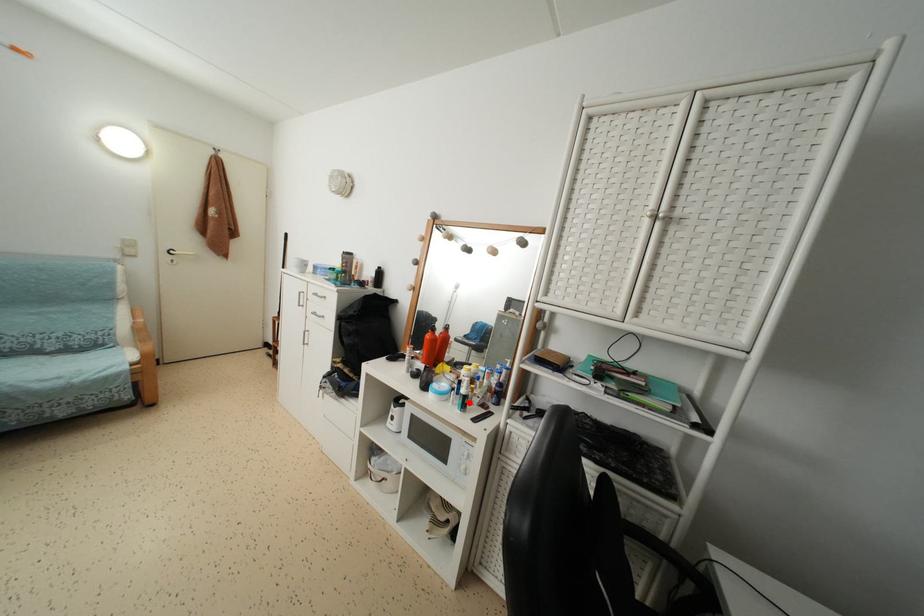
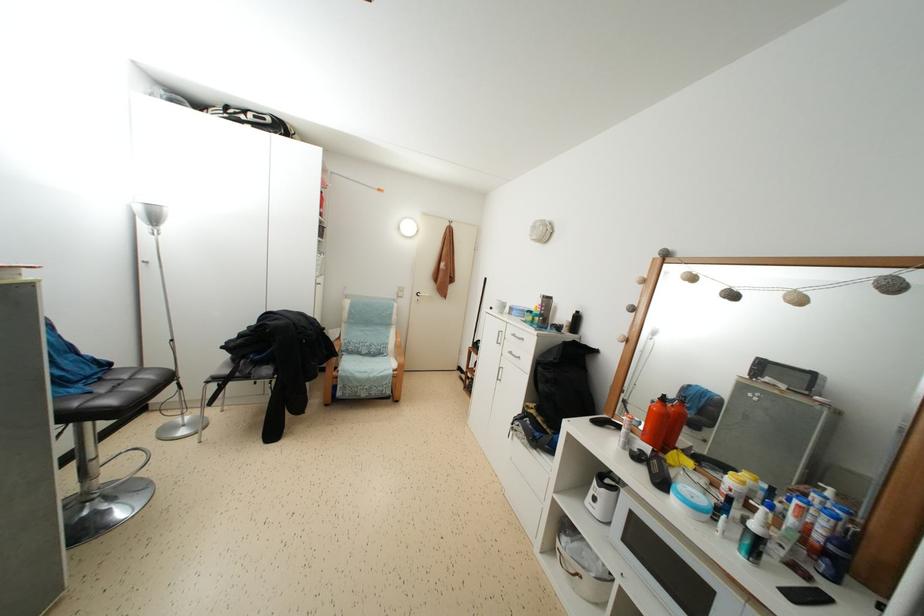
Where in the second image is the point corresponding to the highlighted location from the first image?

(763, 546)